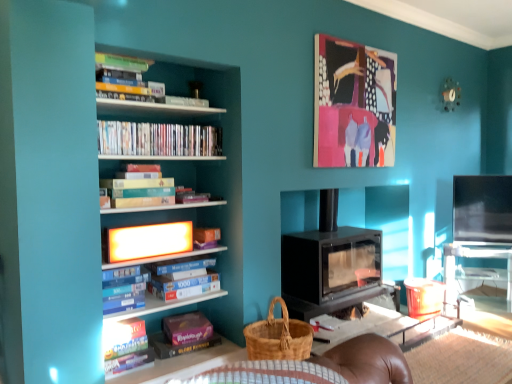
Locate an element on the screen. Image resolution: width=512 pixels, height=384 pixels. free space underneath transparent plastic table at right (from a real-world perspective) is located at coordinates (490, 312).